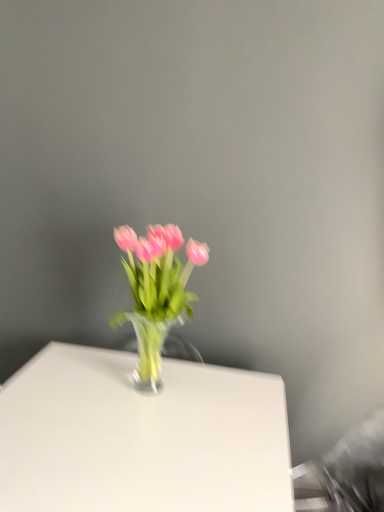
Question: From a real-world perspective, is pink glass vase at center positioned under white glossy table at center based on gravity?

Choices:
 (A) yes
 (B) no

Answer: (B)

Question: From a real-world perspective, is pink glass vase at center on white glossy table at center?

Choices:
 (A) yes
 (B) no

Answer: (A)

Question: Is pink glass vase at center facing away from white glossy table at center?

Choices:
 (A) yes
 (B) no

Answer: (B)

Question: Does pink glass vase at center have a lesser height compared to white glossy table at center?

Choices:
 (A) no
 (B) yes

Answer: (B)

Question: Is pink glass vase at center positioned behind white glossy table at center?

Choices:
 (A) no
 (B) yes

Answer: (B)

Question: From the image's perspective, is pink glass vase at center beneath white glossy table at center?

Choices:
 (A) no
 (B) yes

Answer: (A)

Question: Is white glossy table at center further to the viewer compared to pink glass vase at center?

Choices:
 (A) yes
 (B) no

Answer: (B)

Question: Considering the relative sizes of white glossy table at center and pink glass vase at center in the image provided, is white glossy table at center shorter than pink glass vase at center?

Choices:
 (A) no
 (B) yes

Answer: (A)

Question: Considering the relative sizes of white glossy table at center and pink glass vase at center in the image provided, is white glossy table at center smaller than pink glass vase at center?

Choices:
 (A) yes
 (B) no

Answer: (B)

Question: Considering the relative sizes of white glossy table at center and pink glass vase at center in the image provided, is white glossy table at center bigger than pink glass vase at center?

Choices:
 (A) no
 (B) yes

Answer: (B)

Question: From a real-world perspective, is white glossy table at center physically above pink glass vase at center?

Choices:
 (A) no
 (B) yes

Answer: (A)

Question: Can we say white glossy table at center lies outside pink glass vase at center?

Choices:
 (A) no
 (B) yes

Answer: (B)

Question: In terms of width, does pink glass vase at center look wider or thinner when compared to white glossy table at center?

Choices:
 (A) thin
 (B) wide

Answer: (A)